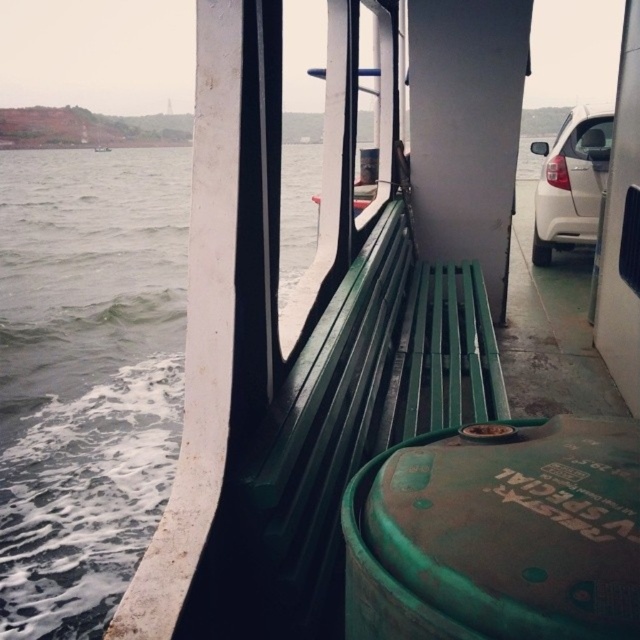
Does point (116, 292) come farther from viewer compared to point (540, 196)?

Yes, it is behind point (540, 196).

Is green matte water at left smaller than white matte car at right?

No.

This screenshot has width=640, height=640. Describe the element at coordinates (84, 376) in the screenshot. I see `green matte water at left` at that location.

Where is `green matte water at left`? The width and height of the screenshot is (640, 640). green matte water at left is located at coordinates (84, 376).

Is green painted wood bench at center to the right of white matte car at right from the viewer's perspective?

No, green painted wood bench at center is not to the right of white matte car at right.

Is point (476, 376) less distant than point (588, 180)?

Yes.

What do you see at coordinates (364, 408) in the screenshot? This screenshot has width=640, height=640. I see `green painted wood bench at center` at bounding box center [364, 408].

Locate an element on the screen. green painted wood bench at center is located at coordinates (364, 408).

Does green matte water at left have a greater height compared to green painted wood bench at center?

Yes.

Which is more to the left, green matte water at left or green painted wood bench at center?

Positioned to the left is green matte water at left.

Is point (154, 161) behind point (288, 420)?

Yes, point (154, 161) is behind point (288, 420).

Image resolution: width=640 pixels, height=640 pixels. In order to click on green matte water at left in this screenshot , I will do `click(84, 376)`.